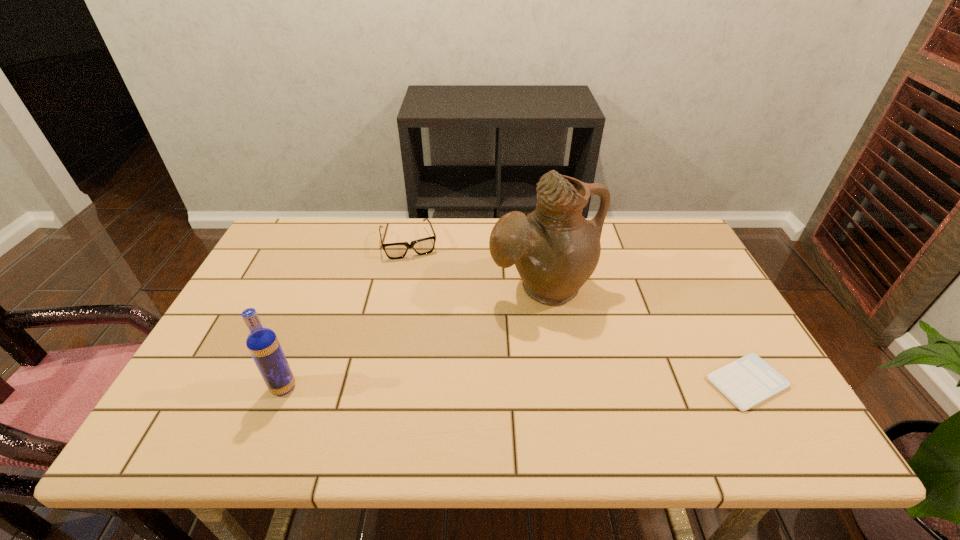
The width and height of the screenshot is (960, 540). Find the location of `the second tallest object`. the second tallest object is located at coordinates (262, 343).

Locate an element on the screen. vodka is located at coordinates (262, 343).

Identify the location of calculator. (748, 381).

The height and width of the screenshot is (540, 960). I want to click on the rightmost object, so click(x=748, y=381).

Where is `pitcher`? The image size is (960, 540). pitcher is located at coordinates [x=555, y=249].

Where is `the third nearest object`? the third nearest object is located at coordinates (555, 249).

This screenshot has width=960, height=540. Identify the location of the third tallest object. (423, 246).

In order to click on sunglasses in this screenshot , I will do `click(423, 246)`.

Where is `free space located 0.190m on the back of the third shortest object`? Image resolution: width=960 pixels, height=540 pixels. free space located 0.190m on the back of the third shortest object is located at coordinates (311, 318).

Image resolution: width=960 pixels, height=540 pixels. Find the location of `free space located on the left of the shortest object`. free space located on the left of the shortest object is located at coordinates (642, 382).